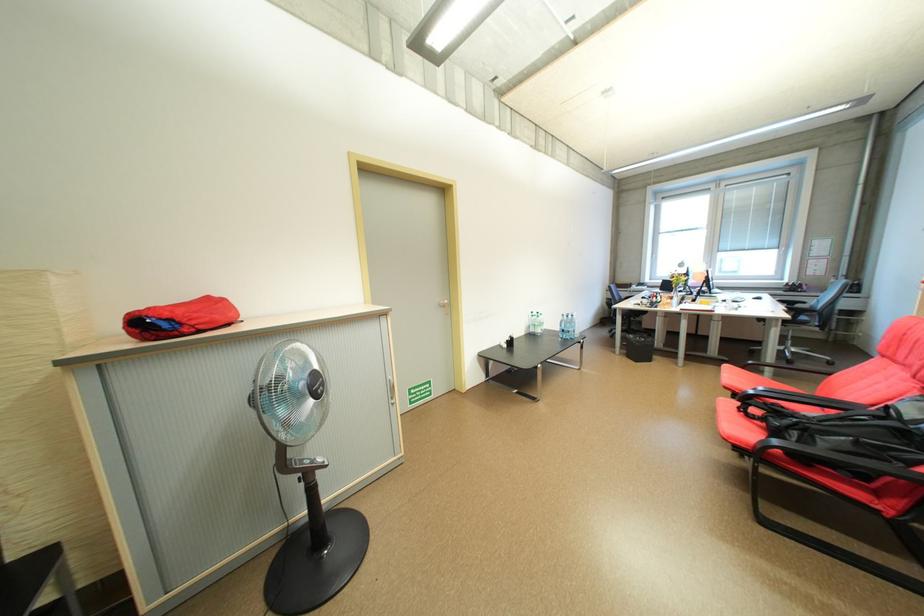
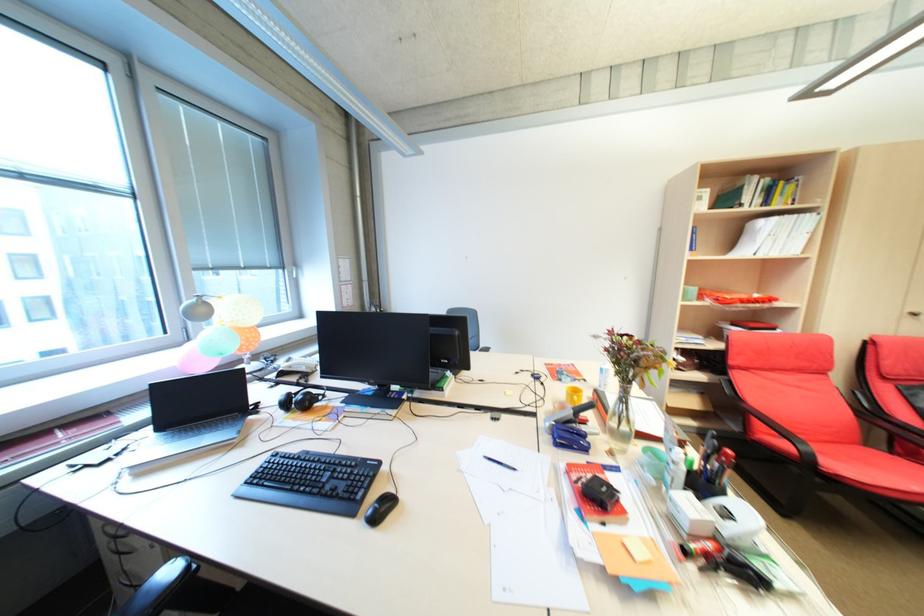
Question: I am providing you with two images of the same scene from different viewpoints. Which of the following objects are not visible in image2?

Choices:
 (A) blue stapler
 (B) red first-aid pouch
 (C) computer keyboard
 (D) black headphones

Answer: (C)